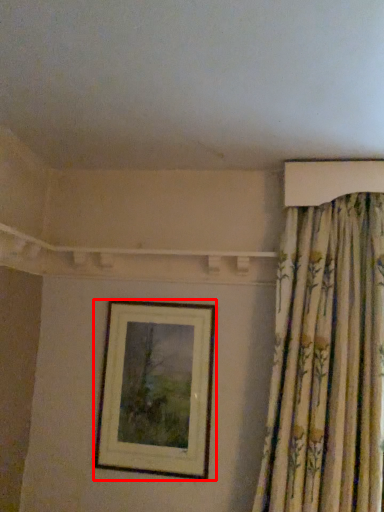
Question: From the image's perspective, what is the correct spatial relationship of picture frame (annotated by the red box) in relation to curtain?

Choices:
 (A) above
 (B) below

Answer: (B)